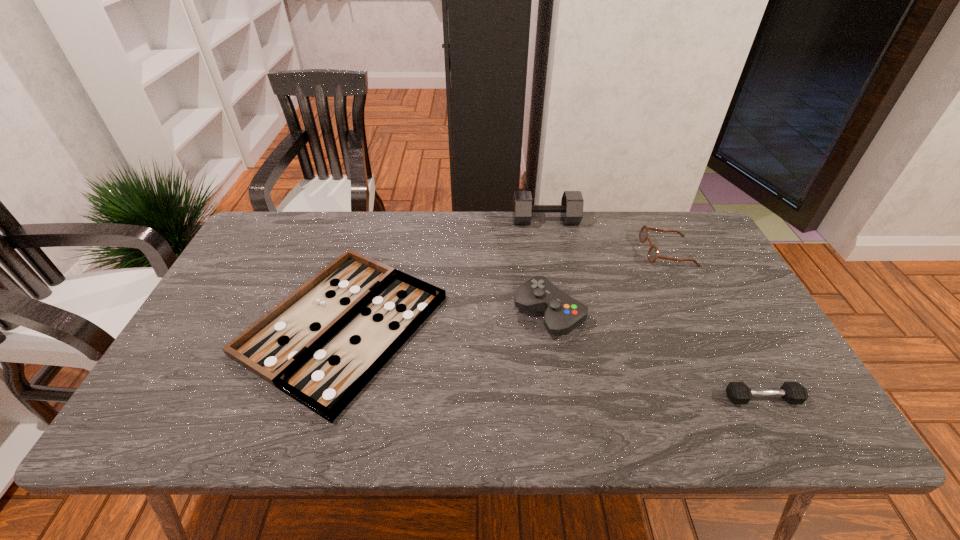
Find the location of `object that is at the left edge`. object that is at the left edge is located at coordinates (321, 345).

The image size is (960, 540). Identify the location of spectacles that is at the right edge. (652, 255).

What are the coordinates of `dumbbell that is at the right edge` in the screenshot? It's located at (737, 392).

The image size is (960, 540). What are the coordinates of `object present at the far left corner` in the screenshot? It's located at [x=321, y=345].

The width and height of the screenshot is (960, 540). What are the coordinates of `object at the near left corner` in the screenshot? It's located at (321, 345).

Where is `object present at the far right corner`? This screenshot has height=540, width=960. object present at the far right corner is located at coordinates (652, 255).

This screenshot has width=960, height=540. Identify the location of object located in the near right corner section of the desktop. (737, 392).

In the image, there is a desktop. Where is `free space at the far edge`? Image resolution: width=960 pixels, height=540 pixels. free space at the far edge is located at coordinates (439, 248).

Where is `vacant area at the near edge`? vacant area at the near edge is located at coordinates (497, 420).

Where is `vacant region at the left edge of the desktop`? The image size is (960, 540). vacant region at the left edge of the desktop is located at coordinates (250, 277).